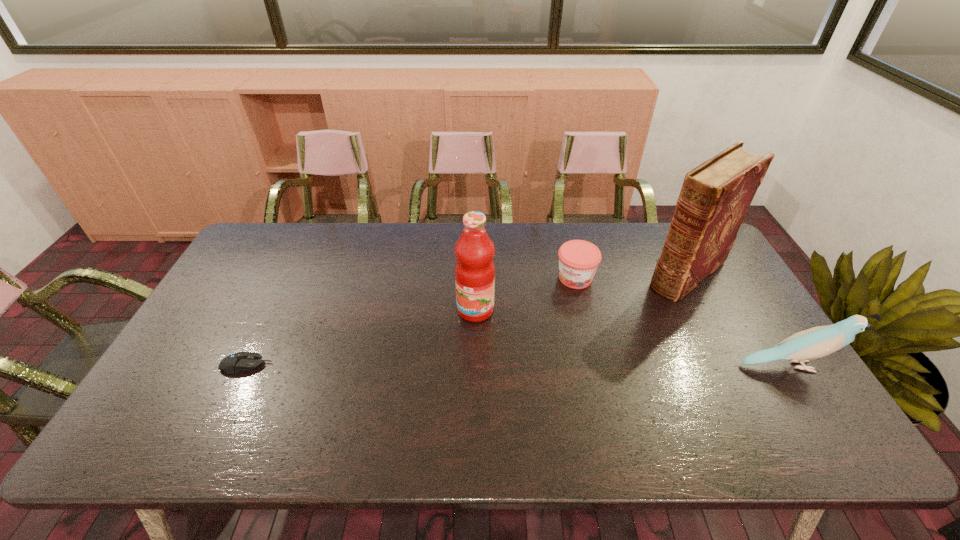
Find the location of a particular element. object located at the left edge is located at coordinates (237, 362).

Find the location of a particular element. The width and height of the screenshot is (960, 540). bird located at the right edge is located at coordinates (820, 341).

The height and width of the screenshot is (540, 960). I want to click on hardback book at the right edge, so click(716, 195).

Find the location of `object at the far right corner`. object at the far right corner is located at coordinates (716, 195).

You are a GUI agent. You are given a task and a screenshot of the screen. Output one action in this format:
    pyautogui.click(x=<x>, y=<y>)
    Task: Click on the vacant space at the far edge
    Image resolution: width=960 pixels, height=540 pixels.
    Given the screenshot: What is the action you would take?
    pyautogui.click(x=552, y=252)

The image size is (960, 540). Find the location of `vacant space at the near edge of the desktop`. vacant space at the near edge of the desktop is located at coordinates (696, 394).

At what (x,y) coordinates should I click in order to perform the action: click on vacant space at the near right corner of the desktop. Please return your answer as a coordinate pair (x, y). The width and height of the screenshot is (960, 540). Looking at the image, I should click on (812, 406).

Where is `vacant point located between the bird and the leftmost object`? vacant point located between the bird and the leftmost object is located at coordinates (518, 366).

Find the location of `free spot between the third object from left to right and the tallest object`. free spot between the third object from left to right and the tallest object is located at coordinates (632, 275).

Image resolution: width=960 pixels, height=540 pixels. I want to click on empty location between the hardback book and the second shortest object, so click(632, 275).